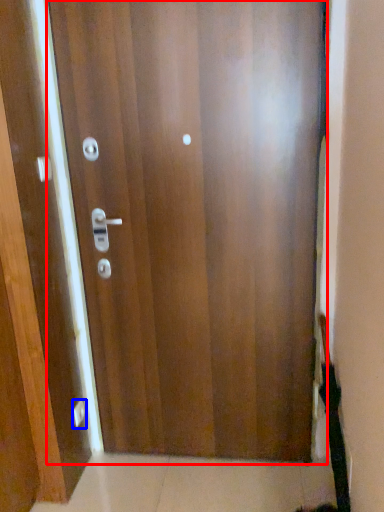
Question: Which object appears closest to the camera in this image, door (highlighted by a red box) or knob (highlighted by a blue box)?

Choices:
 (A) door
 (B) knob

Answer: (A)